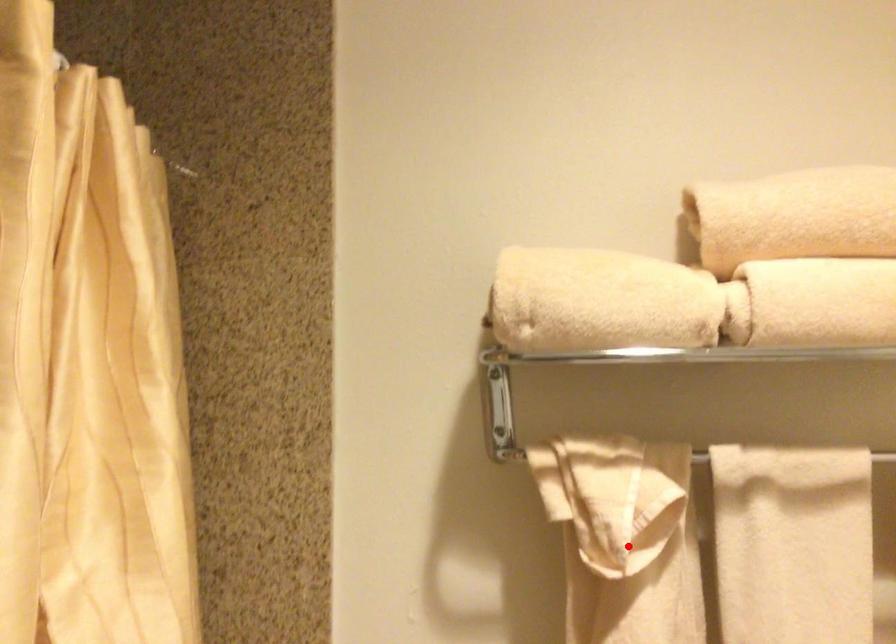
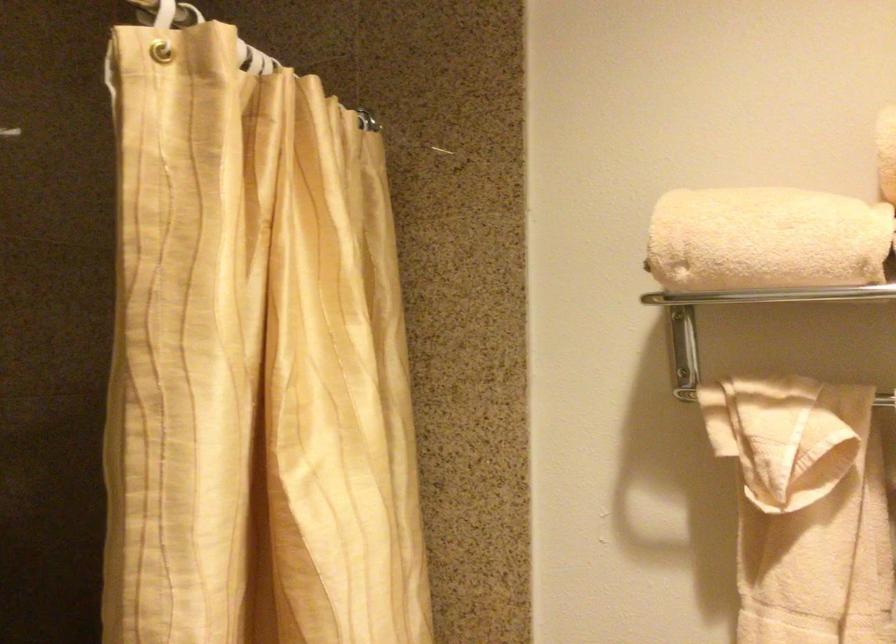
Find the pixel in the second image that matches the highlighted location in the first image.

(793, 486)